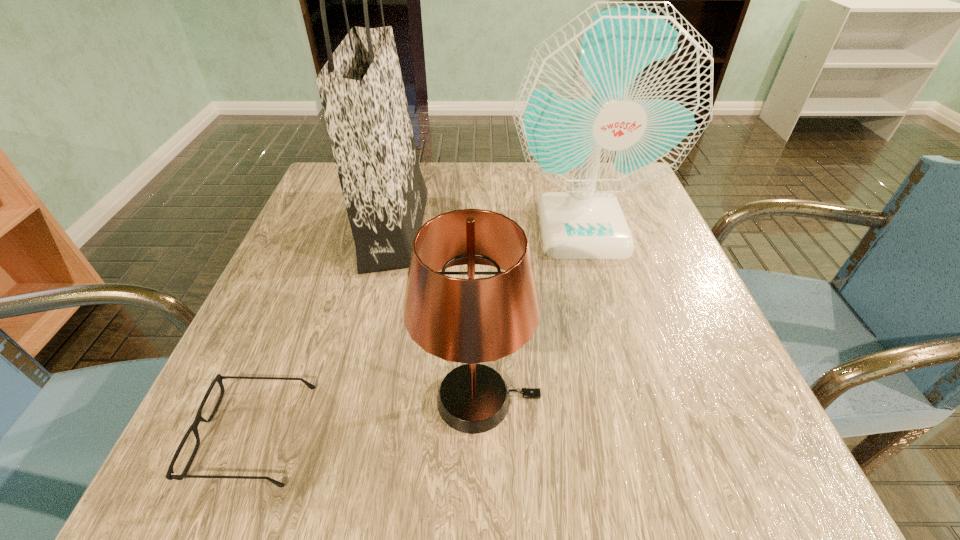
Locate an element on the screen. The width and height of the screenshot is (960, 540). lampshade that is at the near edge is located at coordinates (470, 321).

I want to click on spectacles at the near edge, so [x=170, y=475].

You are a GUI agent. You are given a task and a screenshot of the screen. Output one action in this format:
    pyautogui.click(x=<x>, y=<y>)
    Task: Click on the shopping bag positioned at the left edge
    This screenshot has height=540, width=960.
    Given the screenshot: What is the action you would take?
    click(x=361, y=89)

At what (x,y) coordinates should I click in order to perform the action: click on spectacles that is at the left edge. Please return your answer as a coordinate pair (x, y). The image size is (960, 540). Looking at the image, I should click on (170, 475).

Where is `object that is at the right edge`? This screenshot has height=540, width=960. object that is at the right edge is located at coordinates (613, 101).

Identify the location of object that is at the far left corner. (361, 89).

Identify the location of object situated at the near left corner. (170, 475).

Identify the location of object that is at the far right corner. The width and height of the screenshot is (960, 540). (613, 101).

At what (x,y) coordinates should I click in order to perform the action: click on free space at the far edge of the desktop. Please return your answer as a coordinate pair (x, y). This screenshot has height=540, width=960. Looking at the image, I should click on (441, 183).

This screenshot has height=540, width=960. I want to click on free space at the near edge, so click(x=353, y=435).